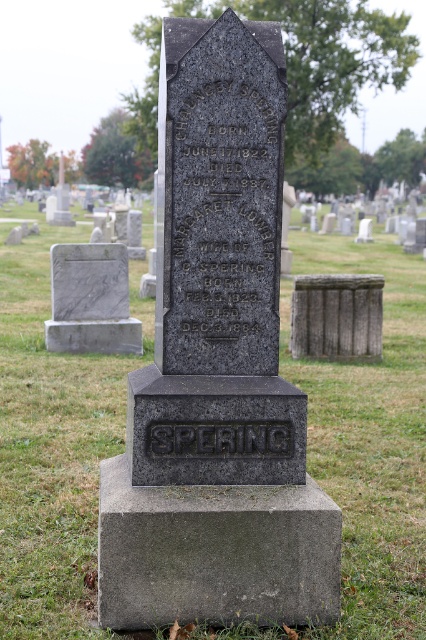
Does gray stone base at center have a lesser height compared to white marble gravestone at left?

Indeed, gray stone base at center has a lesser height compared to white marble gravestone at left.

Is point (230, 492) positioned before point (75, 330)?

Yes, it is in front of point (75, 330).

What do you see at coordinates (215, 552) in the screenshot?
I see `gray stone base at center` at bounding box center [215, 552].

The image size is (426, 640). Identify the location of gray stone base at center. (215, 552).

Is green grass at center to the left of white marble gravestone at left from the viewer's perspective?

In fact, green grass at center is to the right of white marble gravestone at left.

Who is positioned more to the right, green grass at center or white marble gravestone at left?

green grass at center is more to the right.

I want to click on green grass at center, so click(x=52, y=444).

From the picture: Measure the distance from granite gravestone at center to gray stone box at center.

granite gravestone at center and gray stone box at center are 20.08 feet apart from each other.

Who is more distant from viewer, (x=261, y=237) or (x=333, y=291)?

The point (x=333, y=291) is behind.

Identify the location of granite gravestone at center. The width and height of the screenshot is (426, 640). (218, 268).